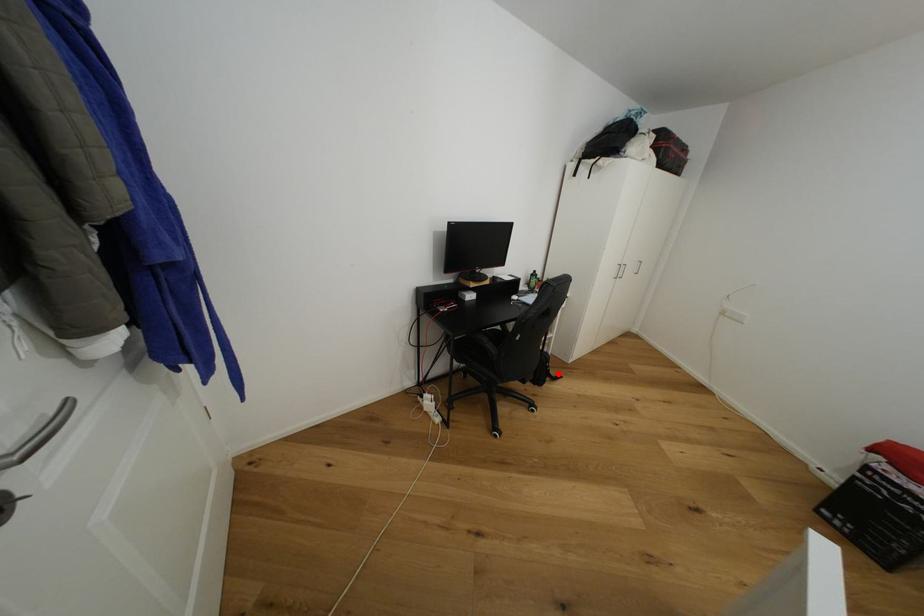
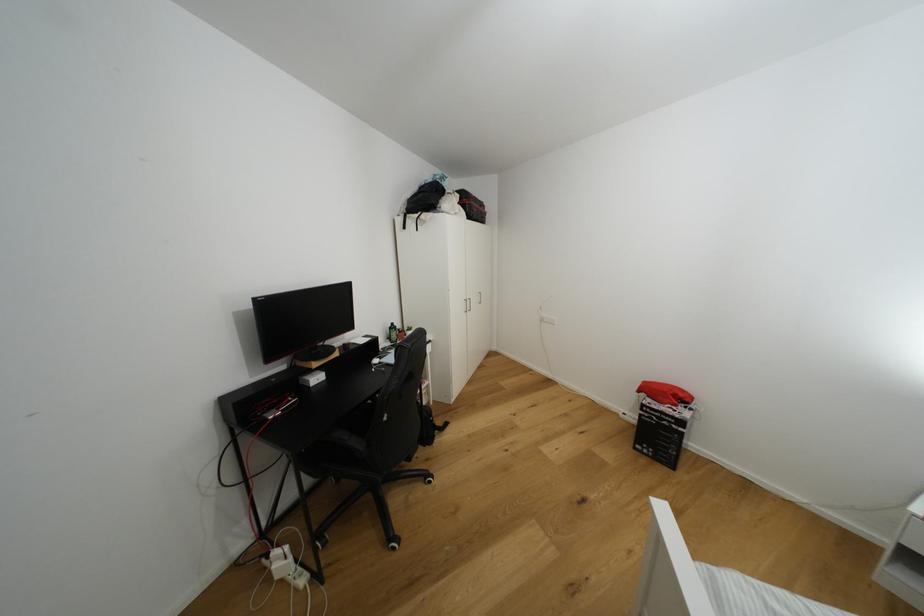
Where in the second image is the point corresponding to the highlighted location from the first image?

(444, 424)